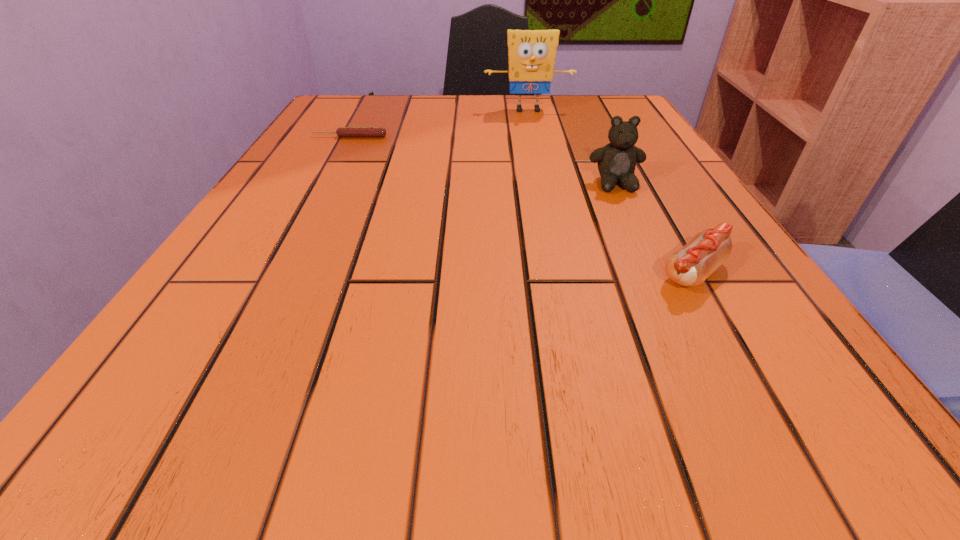
Find the location of a particular element. The image size is (960, 540). free space between the second farthest object and the sponge is located at coordinates (439, 123).

Image resolution: width=960 pixels, height=540 pixels. In order to click on vacant space that is in between the taller sausage and the teddy bear in this screenshot , I will do `click(655, 228)`.

Where is `free area in between the third farthest object and the right sausage`? The width and height of the screenshot is (960, 540). free area in between the third farthest object and the right sausage is located at coordinates (655, 228).

This screenshot has height=540, width=960. I want to click on vacant space that's between the third nearest object and the sponge, so click(x=439, y=123).

Point out which object is positioned as the second nearest to the shorter sausage. Please provide its 2D coordinates. Your answer should be formatted as a tuple, i.e. [(x, y)], where the tuple contains the x and y coordinates of a point satisfying the conditions above.

[(617, 160)]

Find the location of a particular element. This screenshot has height=540, width=960. object identified as the closest to the farthest object is located at coordinates (342, 131).

Image resolution: width=960 pixels, height=540 pixels. In order to click on vacant space that satisfies the following two spatial constraints: 1. on the face of the taller sausage; 2. on the left side of the second nearest object in this screenshot , I will do `click(656, 273)`.

Identify the location of vacant space that satisfies the following two spatial constraints: 1. on the face of the right sausage; 2. on the right side of the second tallest object. (656, 273).

At what (x,y) coordinates should I click in order to perform the action: click on vacant position in the image that satisfies the following two spatial constraints: 1. on the face of the tallest object; 2. on the left side of the right sausage. Please return your answer as a coordinate pair (x, y). The width and height of the screenshot is (960, 540). Looking at the image, I should click on (564, 273).